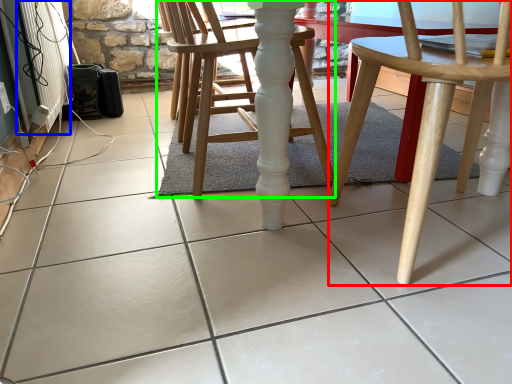
Question: Considering the real-world distances, which object is closest to chair (highlighted by a red box)? radiator (highlighted by a blue box) or chair (highlighted by a green box).

Choices:
 (A) radiator
 (B) chair

Answer: (B)